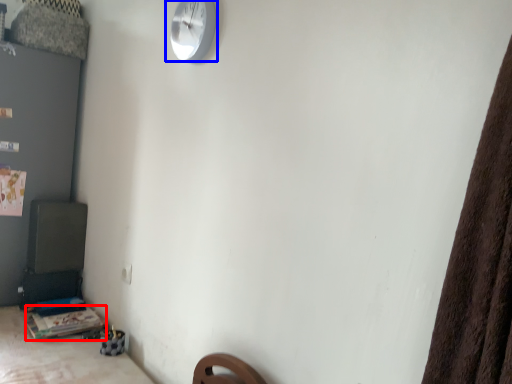
Question: Which point is closer to the camera, table (highlighted by a red box) or wall clock (highlighted by a blue box)?

Choices:
 (A) table
 (B) wall clock

Answer: (B)